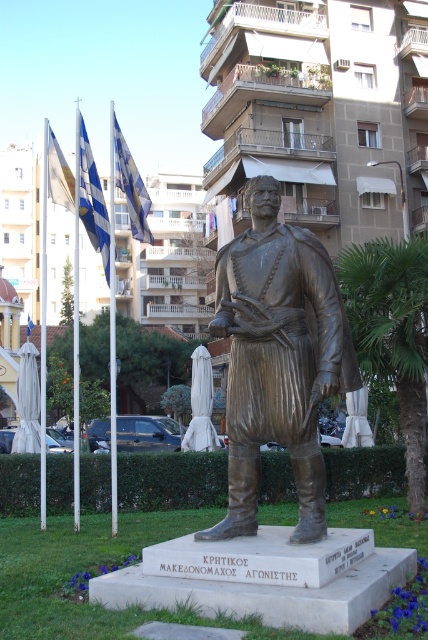
You are a tourist standing at the base of the bronze statue in the public square. You want to take a photo that includes both the green leafy palm tree at center and the blue fabric flag at left. Given that your camera has a maximum zoom range of 50 meters, will you be able to capture both objects in the same frame without moving closer or farther away?

The green leafy palm tree at center is 60.30 meters from the blue fabric flag at left. Since the distance between them exceeds the camera maximum zoom range of 50 meters, you will not be able to capture both in the same frame without moving closer or farther away.